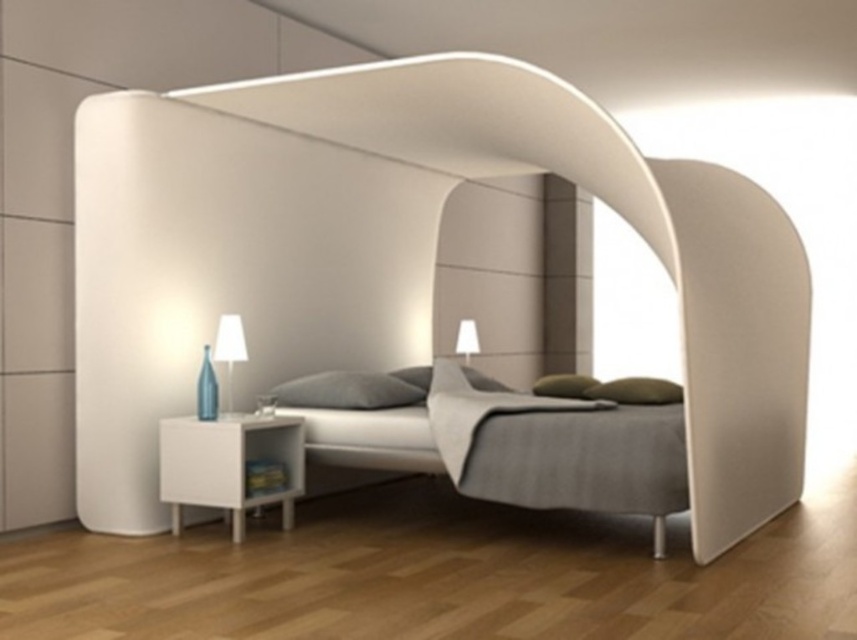
You are standing in the bedroom and want to place a new decorative item between the white matte bed canopy at center and the green fabric pillow at center. Based on their positions, which object should you place it closer to if you want it to be on the right side of the canopy?

The white matte bed canopy at center is to the left of the green fabric pillow at center, so placing the decorative item closer to the green fabric pillow at center would position it on the right side of the canopy.

Based on the photo, you are standing in the bedroom and want to place a new decorative item on the bed. The item is 10 cm tall. You see the green matte pillow at center and the white glossy lampshade at center. Which object is closer to you, and can the item fit between them?

The green matte pillow at center is in front of the white glossy lampshade at center, so the green matte pillow at center is closer to you. The item can fit between them since there is space between the two objects.